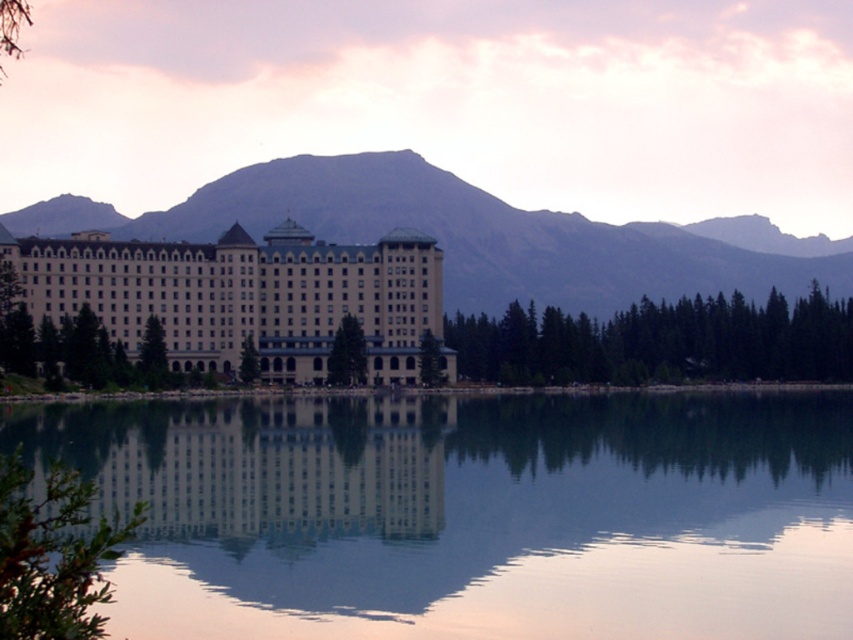
You are standing at the edge of the scene and want to walk towards the transparent glass water at center. Which direction should you face to ensure you are moving towards it while avoiding the gray rocky mountain at center?

You should face to the right to move towards the transparent glass water at center since it is located to the right of the gray rocky mountain at center.

You are a photographer planning to capture the reflection of the white glass building at center in the transparent glass water at center. Based on the scene, can you determine if the water is wide enough to fully contain the building within its reflection?

The transparent glass water at center might be wider than white glass building at center, so there is a possibility that the water is wide enough to fully contain the building within its reflection.

You are planning to take a photo of the beige stone hotel at center and the transparent glass water at center. Which object should you focus on first if you want to capture both in a single frame without moving the camera?

Since the transparent glass water at center is wider than the beige stone hotel at center, you should focus on the transparent glass water at center first to ensure it fits entirely within the frame before adjusting for the hotel.